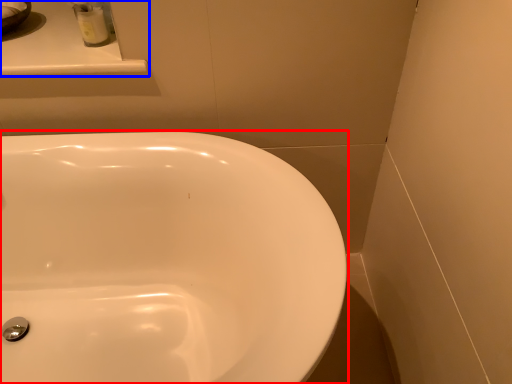
Question: Which object is further to the camera taking this photo, sink (highlighted by a red box) or counter top (highlighted by a blue box)?

Choices:
 (A) sink
 (B) counter top

Answer: (B)